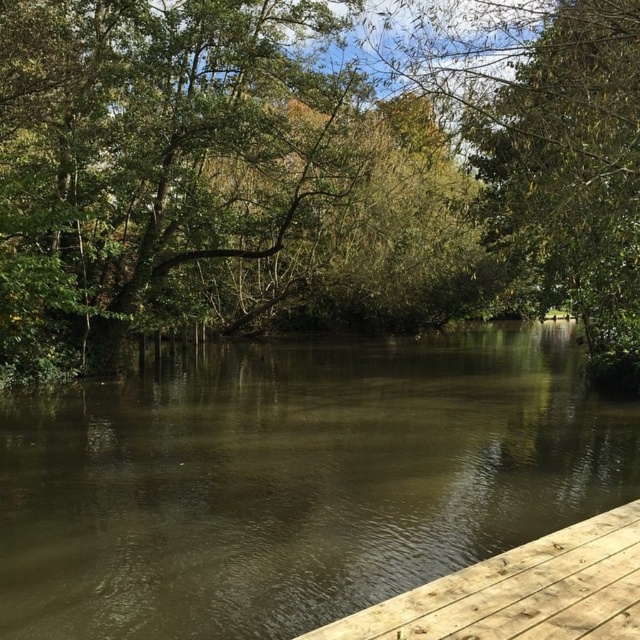
Question: Does green leafy tree at center have a larger size compared to brown murky water at center?

Choices:
 (A) no
 (B) yes

Answer: (B)

Question: Is brown murky water at center bigger than brown wooden dock at lower right?

Choices:
 (A) yes
 (B) no

Answer: (A)

Question: Which object is farther from the camera taking this photo?

Choices:
 (A) green leafy tree at center
 (B) brown wooden dock at lower right

Answer: (A)

Question: Which point is farther from the camera taking this photo?

Choices:
 (A) (65, 634)
 (B) (518, 552)
 (C) (426, 212)

Answer: (C)

Question: Is the position of green leafy tree at center more distant than that of brown wooden dock at lower right?

Choices:
 (A) no
 (B) yes

Answer: (B)

Question: Which of these objects is positioned closest to the green leafy tree at center?

Choices:
 (A) brown murky water at center
 (B) brown wooden dock at lower right

Answer: (A)